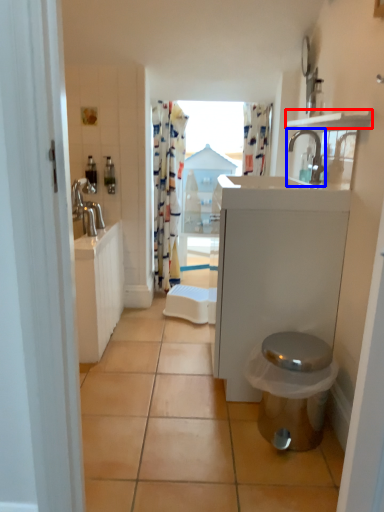
Question: Which of the following is the closest to the observer, balustrade (highlighted by a red box) or tap (highlighted by a blue box)?

Choices:
 (A) balustrade
 (B) tap

Answer: (A)